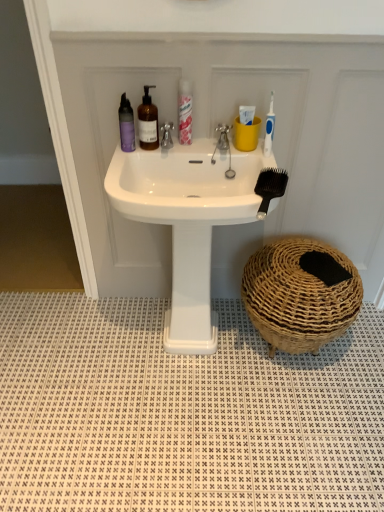
Question: Is white textured tile at lower center turned away from translucent pink spray can at upper center?

Choices:
 (A) yes
 (B) no

Answer: (B)

Question: From a real-world perspective, is white textured tile at lower center on translucent pink spray can at upper center?

Choices:
 (A) no
 (B) yes

Answer: (A)

Question: Is white textured tile at lower center at the left side of translucent pink spray can at upper center?

Choices:
 (A) no
 (B) yes

Answer: (A)

Question: Considering the relative sizes of white textured tile at lower center and translucent pink spray can at upper center in the image provided, is white textured tile at lower center smaller than translucent pink spray can at upper center?

Choices:
 (A) yes
 (B) no

Answer: (B)

Question: Is white textured tile at lower center positioned far away from translucent pink spray can at upper center?

Choices:
 (A) no
 (B) yes

Answer: (B)

Question: Is white glossy sink at center wider or thinner than black plastic brush at center?

Choices:
 (A) thin
 (B) wide

Answer: (B)

Question: Is white glossy sink at center to the left or to the right of black plastic brush at center in the image?

Choices:
 (A) right
 (B) left

Answer: (B)

Question: Is white glossy sink at center taller or shorter than black plastic brush at center?

Choices:
 (A) tall
 (B) short

Answer: (A)

Question: From a real-world perspective, is white glossy sink at center above or below black plastic brush at center?

Choices:
 (A) below
 (B) above

Answer: (A)

Question: Based on their positions, is purple matte bottle at upper left, which is the first mouthwash in left-to-right order, located to the left or right of brown woven basket at lower right?

Choices:
 (A) left
 (B) right

Answer: (A)

Question: From the image's perspective, is purple matte bottle at upper left, which is the first mouthwash in left-to-right order, located above or below brown woven basket at lower right?

Choices:
 (A) above
 (B) below

Answer: (A)

Question: Is point (122, 100) closer or farther from the camera than point (314, 298)?

Choices:
 (A) closer
 (B) farther

Answer: (A)

Question: Is purple matte bottle at upper left, the 2th mouthwash viewed from the right, taller or shorter than brown woven basket at lower right?

Choices:
 (A) tall
 (B) short

Answer: (B)

Question: From a real-world perspective, is white textured tile at lower center positioned above or below brown woven basket at lower right?

Choices:
 (A) above
 (B) below

Answer: (B)

Question: Considering the positions of white textured tile at lower center and brown woven basket at lower right in the image, is white textured tile at lower center bigger or smaller than brown woven basket at lower right?

Choices:
 (A) big
 (B) small

Answer: (B)